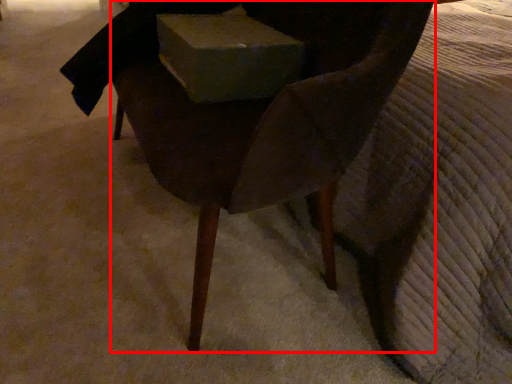
Question: Where is chair (annotated by the red box) located in relation to box in the image?

Choices:
 (A) left
 (B) right

Answer: (A)